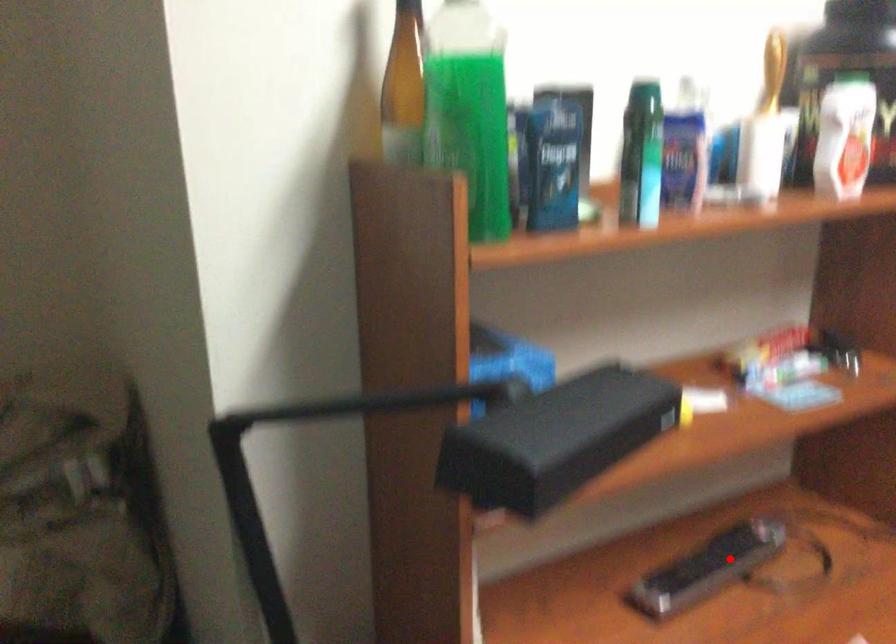
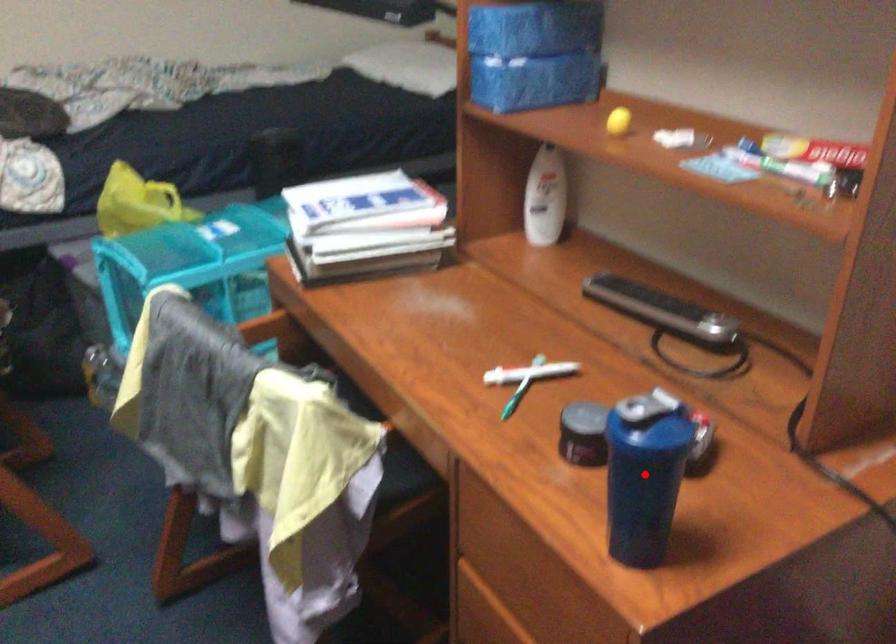
I am providing you with two images of the same scene from different viewpoints. A red point is marked on the first image and another point is marked on the second image. Is the marked point in image1 the same physical position as the marked point in image2?

No